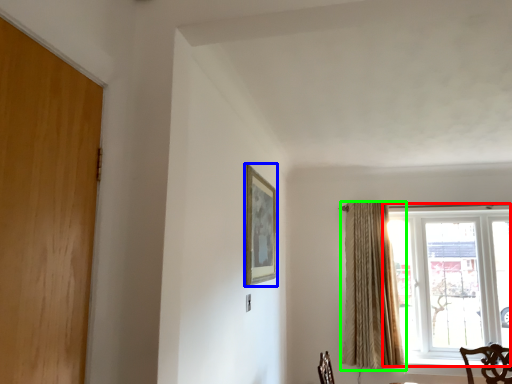
Question: Estimate the real-world distances between objects in this image. Which object is farther from window (highlighted by a red box), picture frame (highlighted by a blue box) or curtain (highlighted by a green box)?

Choices:
 (A) picture frame
 (B) curtain

Answer: (A)